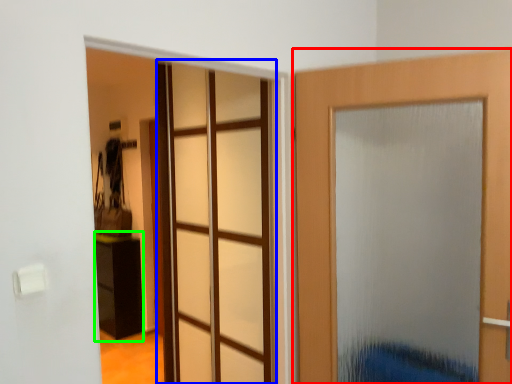
Question: Based on their relative distances, which object is nearer to door (highlighted by a red box)? Choose from glass door (highlighted by a blue box) and furniture (highlighted by a green box).

Choices:
 (A) glass door
 (B) furniture

Answer: (A)